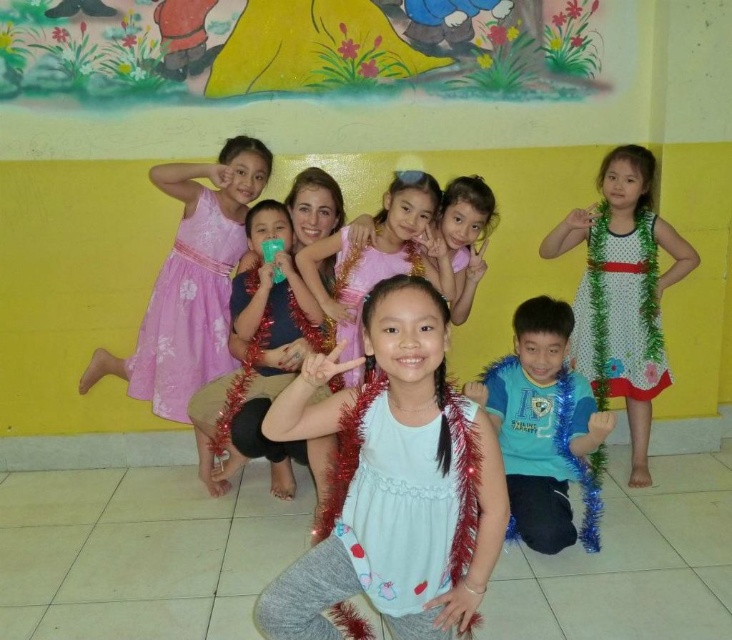
Is white dotted fabric dress at upper right wider than shiny silver necklace at center?

Incorrect, white dotted fabric dress at upper right's width does not surpass shiny silver necklace at center's.

Does white dotted fabric dress at upper right have a lesser height compared to shiny silver necklace at center?

In fact, white dotted fabric dress at upper right may be taller than shiny silver necklace at center.

Between point (608, 282) and point (343, 296), which one is positioned behind?

Positioned behind is point (608, 282).

Locate an element on the screen. Image resolution: width=732 pixels, height=640 pixels. white dotted fabric dress at upper right is located at coordinates (619, 312).

Is point (520, 342) farther from viewer compared to point (280, 468)?

No, it is not.

Where is `blue t-shirt at center`? The width and height of the screenshot is (732, 640). blue t-shirt at center is located at coordinates (542, 428).

I want to click on blue t-shirt at center, so pyautogui.click(x=542, y=428).

Identify the location of blue t-shirt at center. (542, 428).

Between point (436, 451) and point (597, 182), which one is positioned behind?

The point (597, 182) is behind.

Is white tulle dress at center smaller than white dotted dress at right?

Yes.

Between point (343, 557) and point (589, 376), which one is positioned in front?

Point (343, 557)

Locate an element on the screen. The width and height of the screenshot is (732, 640). white tulle dress at center is located at coordinates (392, 483).